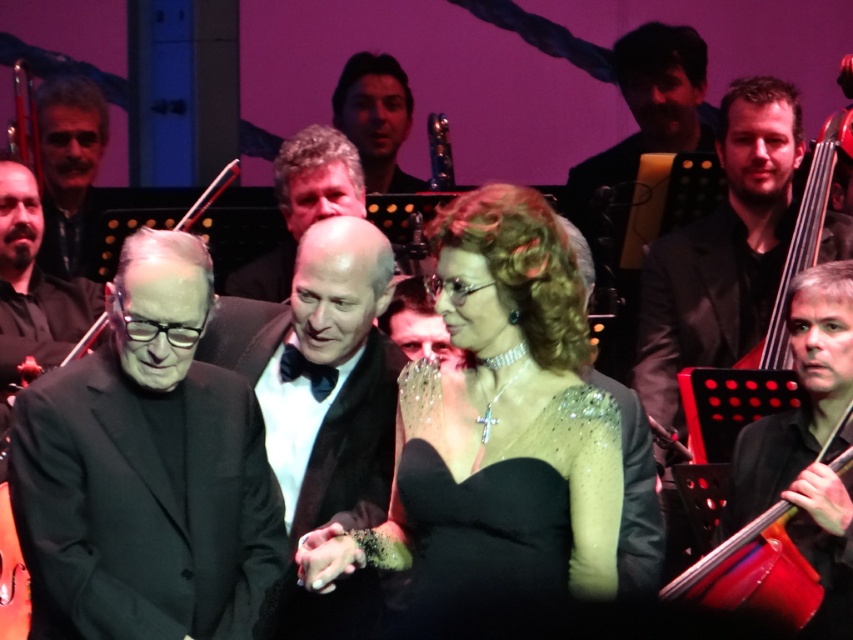
You are at the point labeled point [566,554] and want to move to the point labeled point [421,186]. Is the path between them clear?

Yes, the path between point [566,554] and point [421,186] is clear because point [566,554] is in front of point [421,186], indicating no obstruction between them.

You are a photographer at the event and want to capture a photo of both the sparkly black dress at center and the black matte suit at center. Which one will appear larger in the photo?

The sparkly black dress at center will appear larger in the photo because it is closer to the viewer than the black matte suit at center.